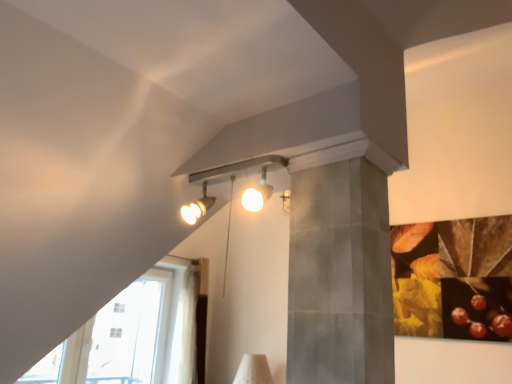
The height and width of the screenshot is (384, 512). In order to click on matte silver track lights at upper center in this screenshot , I will do `click(230, 180)`.

Describe the element at coordinates (230, 180) in the screenshot. The width and height of the screenshot is (512, 384). I see `matte silver track lights at upper center` at that location.

Looking at this image, what is the approximate width of transparent glass door at lower left?

transparent glass door at lower left is 5.78 inches in width.

Where is `transparent glass door at lower left`? The width and height of the screenshot is (512, 384). transparent glass door at lower left is located at coordinates (128, 334).

This screenshot has height=384, width=512. What do you see at coordinates (128, 334) in the screenshot?
I see `transparent glass door at lower left` at bounding box center [128, 334].

The width and height of the screenshot is (512, 384). Identify the location of matte silver track lights at upper center. (x=230, y=180).

Which is more to the right, transparent glass door at lower left or matte silver track lights at upper center?

matte silver track lights at upper center.

Is transparent glass door at lower left closer to the viewer compared to matte silver track lights at upper center?

Result: No, it is behind matte silver track lights at upper center.

Considering the positions of point (123, 319) and point (212, 179), is point (123, 319) closer or farther from the camera than point (212, 179)?

Clearly, point (123, 319) is more distant from the camera than point (212, 179).

From the image's perspective, who appears lower, transparent glass door at lower left or matte silver track lights at upper center?

From the image's view, transparent glass door at lower left is below.

From a real-world perspective, between transparent glass door at lower left and matte silver track lights at upper center, who is vertically higher?

matte silver track lights at upper center.

Which object is thinner, transparent glass door at lower left or matte silver track lights at upper center?

transparent glass door at lower left.

Is transparent glass door at lower left taller or shorter than matte silver track lights at upper center?

transparent glass door at lower left is taller than matte silver track lights at upper center.

Looking at the image, does transparent glass door at lower left seem bigger or smaller compared to matte silver track lights at upper center?

transparent glass door at lower left is bigger than matte silver track lights at upper center.

Would you say transparent glass door at lower left is inside or outside matte silver track lights at upper center?

transparent glass door at lower left cannot be found inside matte silver track lights at upper center.

Is transparent glass door at lower left beside matte silver track lights at upper center?

No, transparent glass door at lower left is not touching matte silver track lights at upper center.

Is transparent glass door at lower left oriented towards matte silver track lights at upper center?

No, transparent glass door at lower left is not turned towards matte silver track lights at upper center.

Looking at this image, measure the distance from transparent glass door at lower left to matte silver track lights at upper center.

transparent glass door at lower left and matte silver track lights at upper center are 3.78 meters apart from each other.

You are a GUI agent. You are given a task and a screenshot of the screen. Output one action in this format:
    pyautogui.click(x=<x>, y=<y>)
    Task: Click on the lamp above the transparent glass door at lower left (from the image's perspective)
    This screenshot has height=384, width=512.
    Given the screenshot: What is the action you would take?
    pyautogui.click(x=230, y=180)

Between matte silver track lights at upper center and transparent glass door at lower left, which one appears on the left side from the viewer's perspective?

transparent glass door at lower left.

From the picture: Between matte silver track lights at upper center and transparent glass door at lower left, which one is positioned behind?

transparent glass door at lower left is further from the camera.

Which point is more forward, [214,170] or [160,287]?

The point [214,170] is in front.

From the image's perspective, would you say matte silver track lights at upper center is positioned over transparent glass door at lower left?

Yes, from the image's perspective, matte silver track lights at upper center is on top of transparent glass door at lower left.

From a real-world perspective, is matte silver track lights at upper center physically located above or below transparent glass door at lower left?

From a real-world perspective, matte silver track lights at upper center is physically above transparent glass door at lower left.

Which of these two, matte silver track lights at upper center or transparent glass door at lower left, is thinner?

Thinner between the two is transparent glass door at lower left.

Does matte silver track lights at upper center have a lesser height compared to transparent glass door at lower left?

Indeed, matte silver track lights at upper center has a lesser height compared to transparent glass door at lower left.

Considering the sizes of matte silver track lights at upper center and transparent glass door at lower left in the image, is matte silver track lights at upper center bigger or smaller than transparent glass door at lower left?

matte silver track lights at upper center is smaller than transparent glass door at lower left.

Can we say matte silver track lights at upper center lies outside transparent glass door at lower left?

Yes, matte silver track lights at upper center is outside of transparent glass door at lower left.

Is matte silver track lights at upper center far away from transparent glass door at lower left?

Yes, matte silver track lights at upper center is far from transparent glass door at lower left.

Is matte silver track lights at upper center aimed at transparent glass door at lower left?

No, matte silver track lights at upper center is not aimed at transparent glass door at lower left.

Measure the distance from matte silver track lights at upper center to transparent glass door at lower left.

matte silver track lights at upper center and transparent glass door at lower left are 3.78 meters apart.

Where is `glass door behind the matte silver track lights at upper center`? glass door behind the matte silver track lights at upper center is located at coordinates (128, 334).

Identify the location of glass door below the matte silver track lights at upper center (from a real-world perspective). (128, 334).

You are a GUI agent. You are given a task and a screenshot of the screen. Output one action in this format:
    pyautogui.click(x=<x>, y=<y>)
    Task: Click on the lamp on the right of transparent glass door at lower left
    
    Given the screenshot: What is the action you would take?
    pyautogui.click(x=230, y=180)